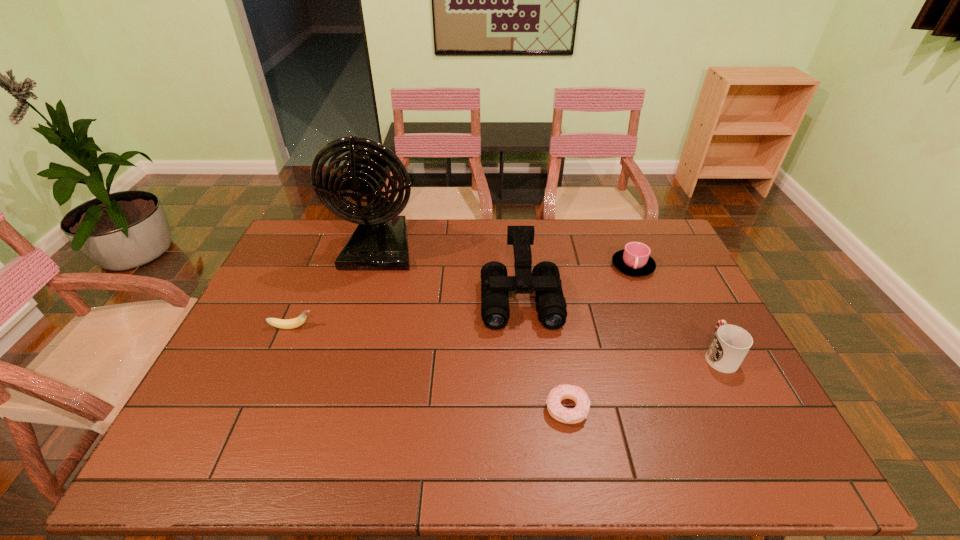
The image size is (960, 540). I want to click on free space located on the front lenses of the fifth shortest object, so click(x=533, y=416).

Where is `vacant space located 0.350m on the handle side of the third tallest object`? Image resolution: width=960 pixels, height=540 pixels. vacant space located 0.350m on the handle side of the third tallest object is located at coordinates (670, 260).

Locate an element on the screen. This screenshot has height=540, width=960. free location located 0.240m on the handle side of the third tallest object is located at coordinates (682, 282).

You are a GUI agent. You are given a task and a screenshot of the screen. Output one action in this format:
    pyautogui.click(x=<x>, y=<y>)
    Task: Click on the vacant space located on the handle side of the third tallest object
    This screenshot has height=540, width=960.
    Given the screenshot: What is the action you would take?
    pyautogui.click(x=694, y=306)

In order to click on vacant region located on the side with the handle of the second object from right to left in this screenshot , I will do `click(644, 295)`.

Locate an element on the screen. This screenshot has width=960, height=540. blank area located 0.400m at the stem of the banana is located at coordinates (454, 327).

Where is `free spot located on the right of the nearest object`? This screenshot has width=960, height=540. free spot located on the right of the nearest object is located at coordinates (730, 409).

Find the location of a particular element. The image size is (960, 540). fan located at the far edge is located at coordinates (380, 242).

At what (x,y) coordinates should I click in order to perform the action: click on cup at the far edge. Please return your answer as a coordinate pair (x, y). Looking at the image, I should click on (635, 259).

Find the location of `object at the left edge`. object at the left edge is located at coordinates (296, 322).